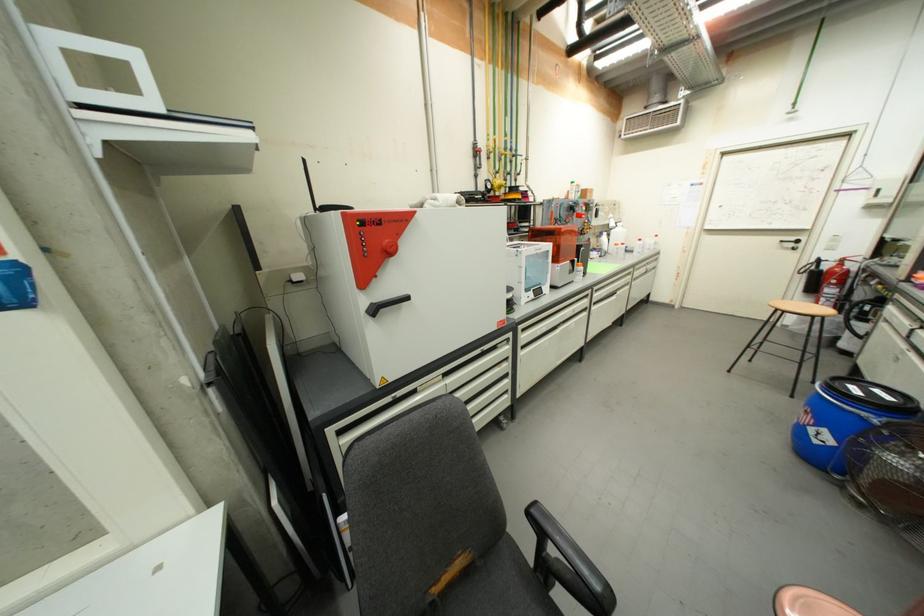
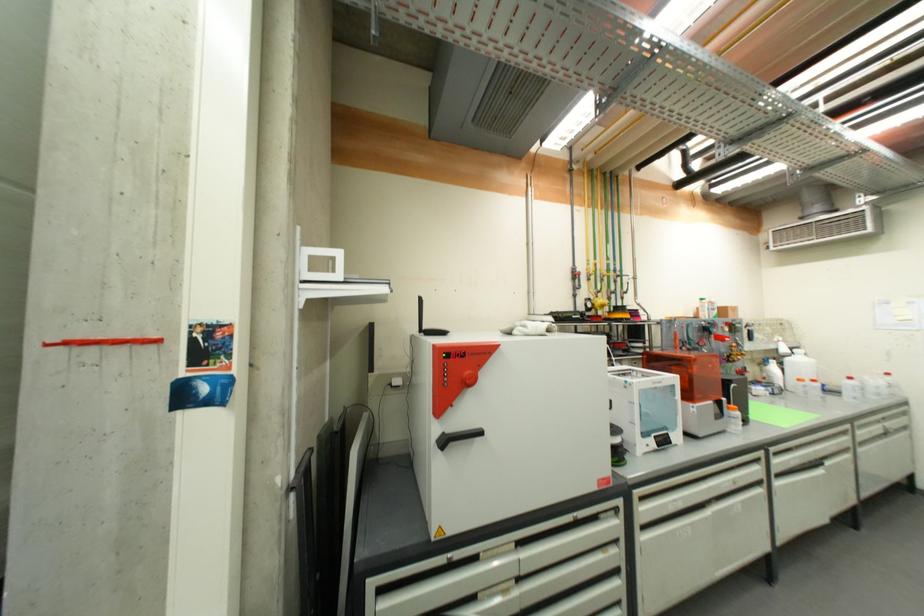
Locate, in the second image, the point that corresponds to the point at 599,302 in the first image.

(779, 472)